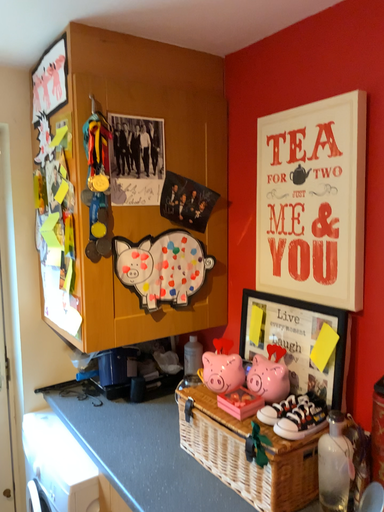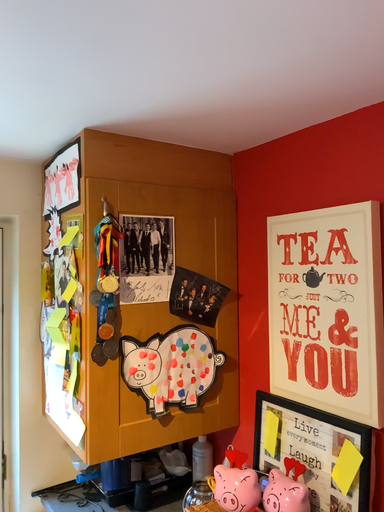
Question: How did the camera likely rotate when shooting the video?

Choices:
 (A) rotated downward
 (B) rotated upward

Answer: (B)